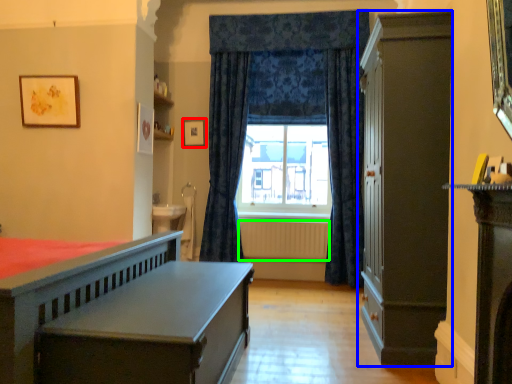
Question: Which is nearer to the picture frame (highlighted by a red box)? cabinetry (highlighted by a blue box) or radiator (highlighted by a green box).

Choices:
 (A) cabinetry
 (B) radiator

Answer: (B)